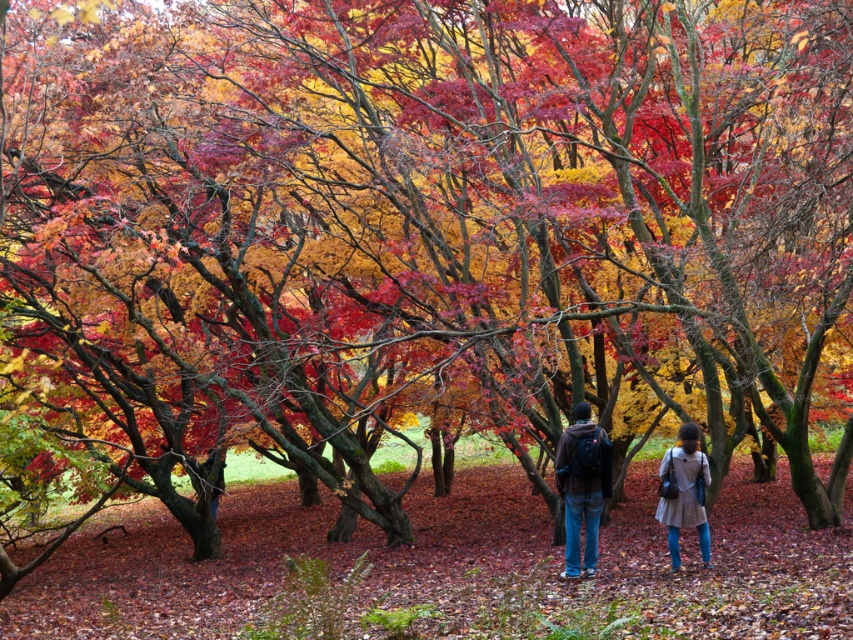
Question: Which object is positioned closest to the light brown fabric coat at lower right?

Choices:
 (A) brown leather jacket at center
 (B) matte brown jacket at center

Answer: (B)

Question: Estimate the real-world distances between objects in this image. Which object is farther from the light brown fabric coat at lower right?

Choices:
 (A) brown leather jacket at center
 (B) matte brown jacket at center

Answer: (A)

Question: Can you confirm if matte brown jacket at center is positioned to the left of light brown fabric coat at lower right?

Choices:
 (A) yes
 (B) no

Answer: (A)

Question: Which of the following is the farthest from the observer?

Choices:
 (A) matte brown jacket at center
 (B) light brown fabric coat at lower right

Answer: (A)

Question: From the image, what is the correct spatial relationship of matte brown jacket at center in relation to light brown fabric coat at lower right?

Choices:
 (A) right
 (B) left

Answer: (B)

Question: Is matte brown jacket at center wider than light brown fabric coat at lower right?

Choices:
 (A) no
 (B) yes

Answer: (B)